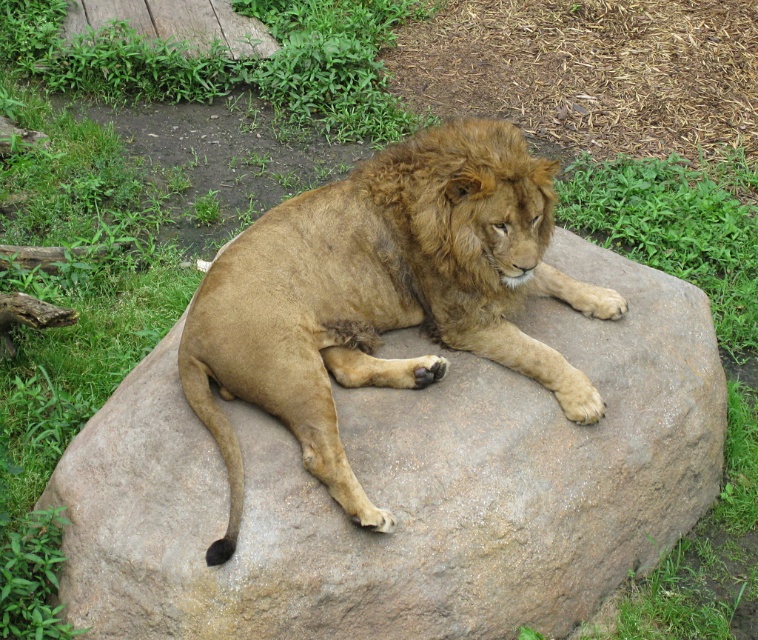
Based on the photo, is golden fur lion at center to the left of brown fuzzy mane at center from the viewer's perspective?

Correct, you'll find golden fur lion at center to the left of brown fuzzy mane at center.

Does golden fur lion at center appear on the right side of brown fuzzy mane at center?

In fact, golden fur lion at center is to the left of brown fuzzy mane at center.

Which is in front, point (558, 364) or point (453, 141)?

Positioned in front is point (453, 141).

Where is `golden fur lion at center`? golden fur lion at center is located at coordinates (381, 296).